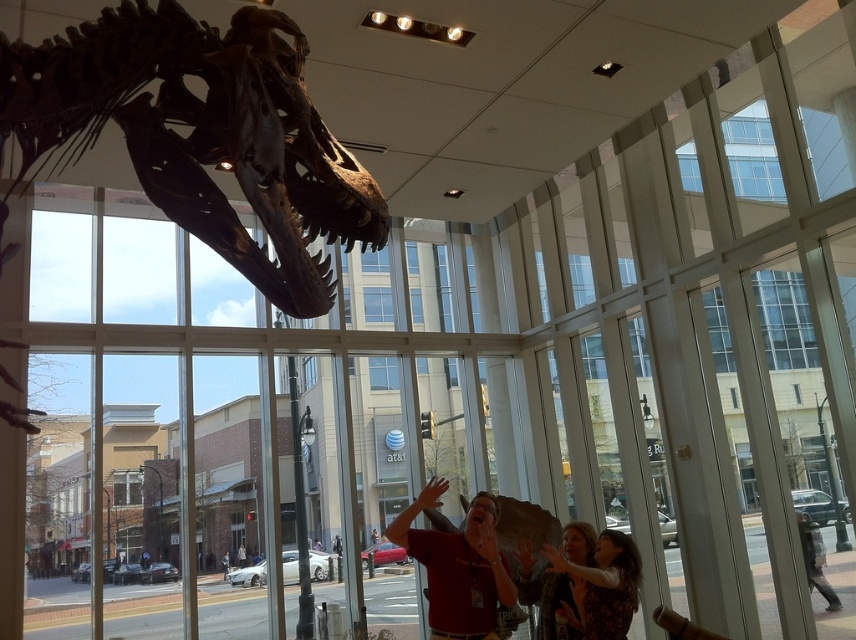
You are a security guard in the building and you need to check both the matte red shirt at center and the dark gray jacket at lower right for safety. Which one should you check first if you want to start with the one closer to the ceiling?

The matte red shirt at center should be checked first because it is located above the dark gray jacket at lower right, meaning it is closer to the ceiling.

Based on the photo, you are standing inside the modern building looking at the Tyrannosaurus rex skeleton. There are two points marked on the window. The first point is at coordinates point [204,74], and the second is at point [591,625]. From your vantage point inside, which point is closer to you?

Point [204,74] is in front of point [591,625], so the first point is closer to you.